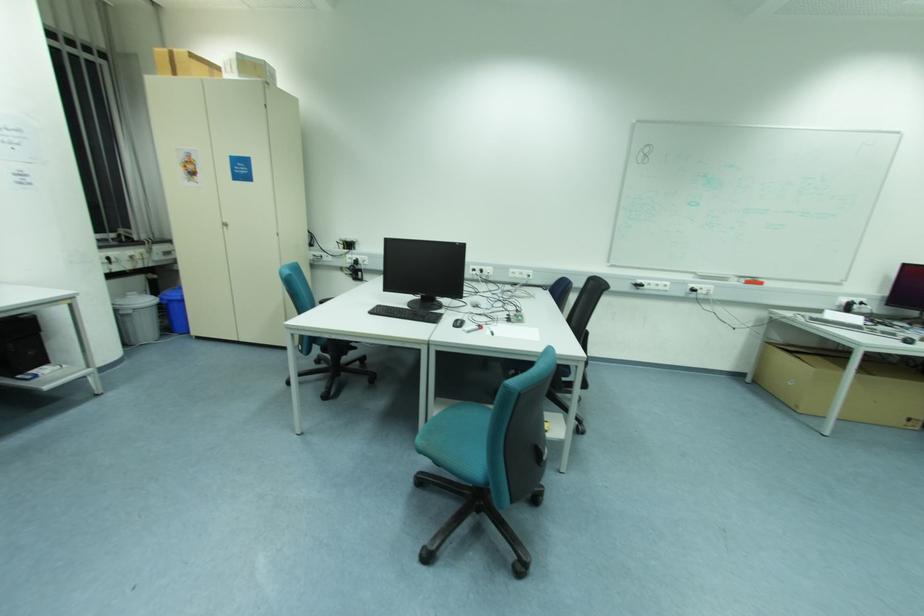
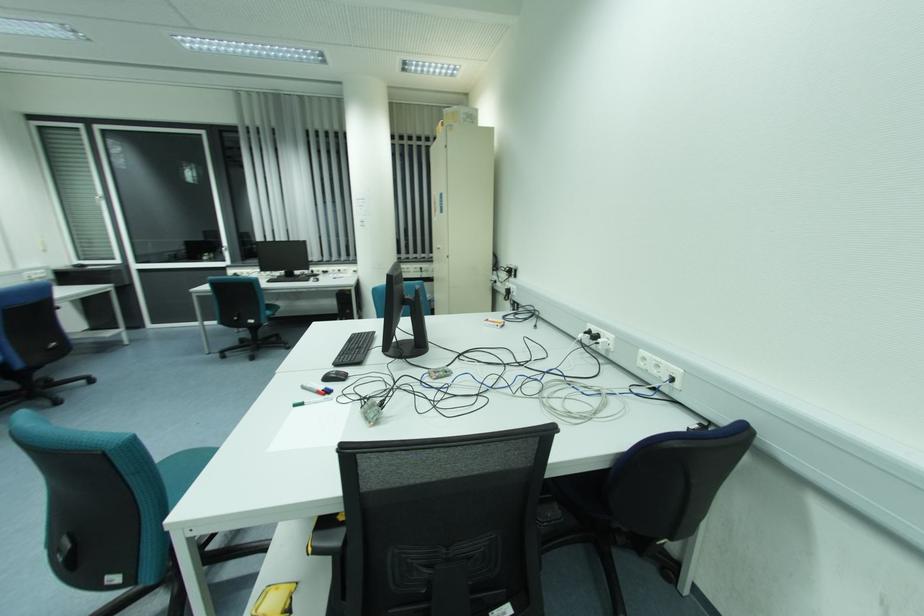
Where in the second image is the point corresponding to pixel 274 82 from the first image?

(469, 120)